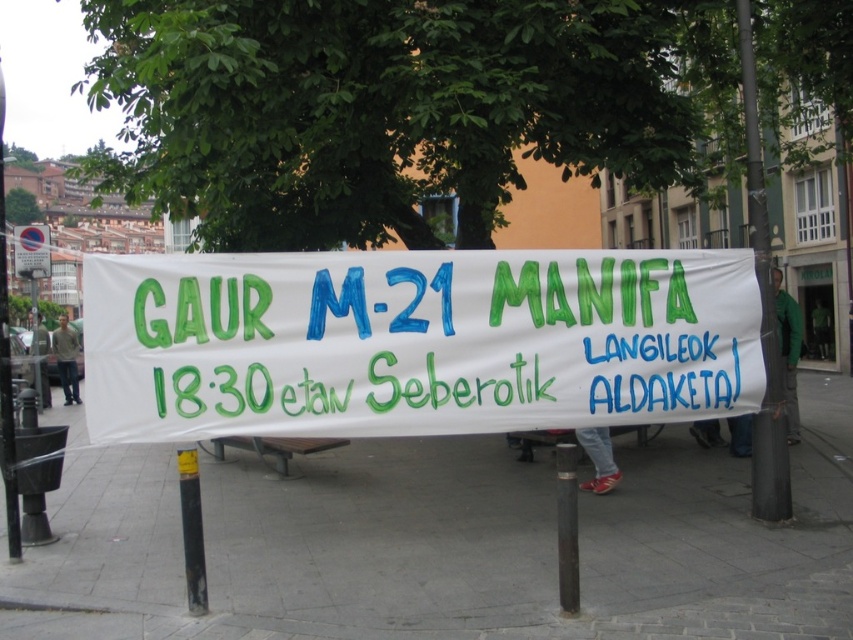
You are a pedestrian standing on the white concrete pavement at center. You want to walk to the brushed metal pole at left. Which direction should you move to reach it?

The white concrete pavement at center is positioned on the right side of the brushed metal pole at left, so you should move to the left to reach the brushed metal pole at left.

You are a pedestrian walking along the street and see the white paper banner at center and the smooth gray pole at right. Which object is located to the left of the other?

The white paper banner at center is positioned on the left side of smooth gray pole at right.